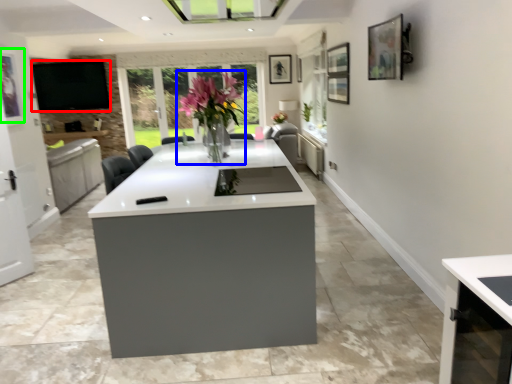
Question: Which is farther away from window screen (highlighted by a red box)? floral arrangement (highlighted by a blue box) or picture frame (highlighted by a green box)?

Choices:
 (A) floral arrangement
 (B) picture frame

Answer: (A)